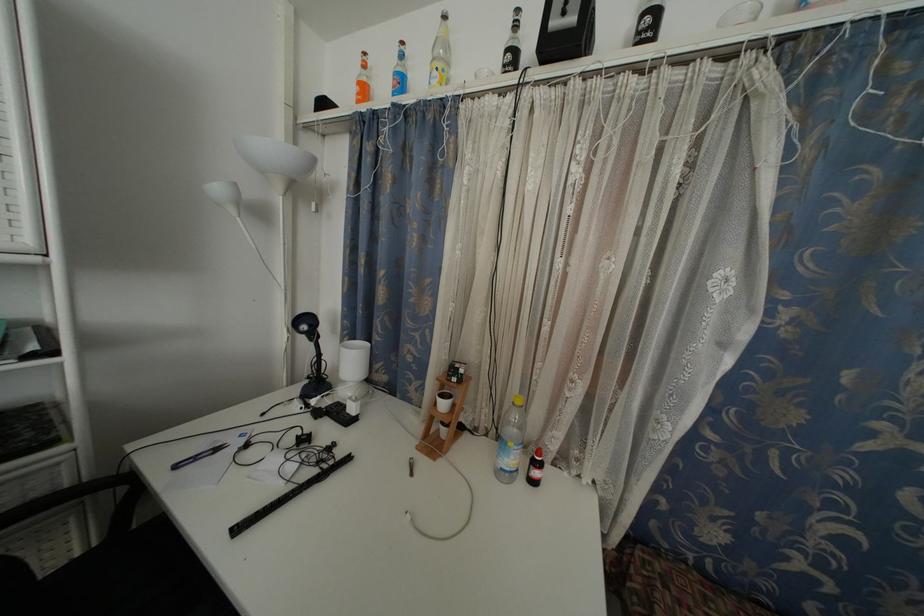
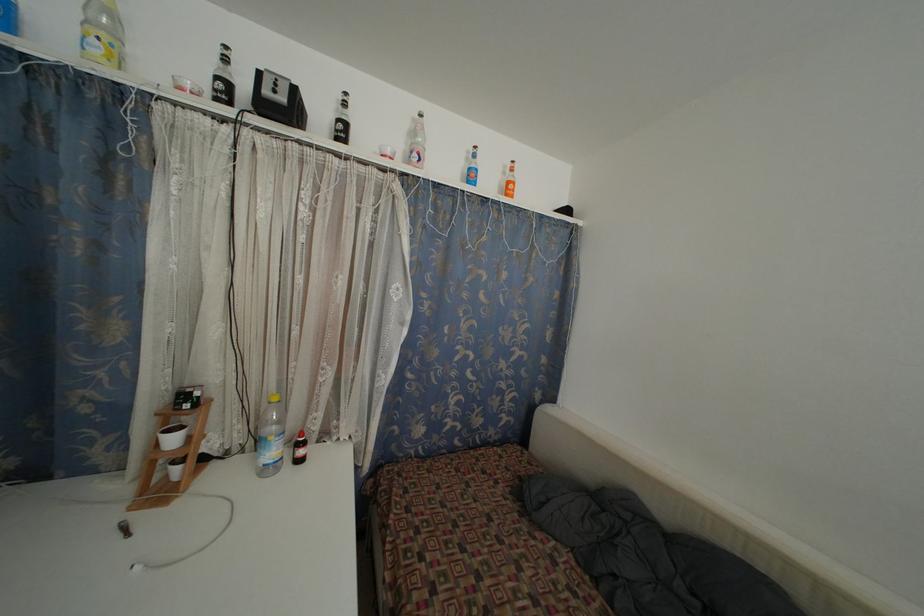
In the second image, find the point that corresponds to pixel 651 26 in the first image.

(345, 132)